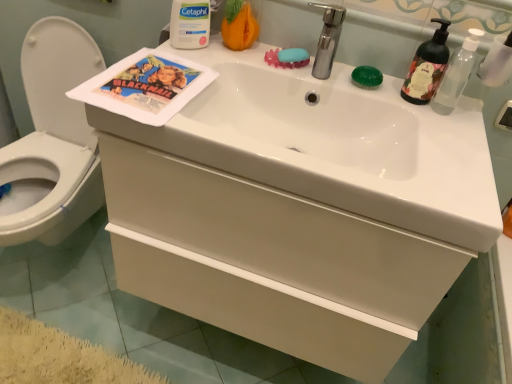
Identify the location of free space to the left of green matte soap dispenser at upper right. This screenshot has width=512, height=384. (371, 88).